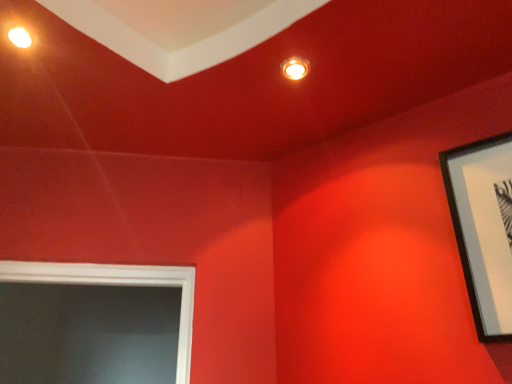
Question: Should I look upward or downward to see black matte picture frame at upper right?

Choices:
 (A) up
 (B) down

Answer: (B)

Question: Could you tell me if black matte picture frame at upper right is facing matte orange light fixture at upper center?

Choices:
 (A) yes
 (B) no

Answer: (B)

Question: Is matte orange light fixture at upper center at the back of black matte picture frame at upper right?

Choices:
 (A) no
 (B) yes

Answer: (A)

Question: Does black matte picture frame at upper right appear on the left side of matte orange light fixture at upper center?

Choices:
 (A) no
 (B) yes

Answer: (A)

Question: Could matte orange light fixture at upper center be considered to be inside black matte picture frame at upper right?

Choices:
 (A) no
 (B) yes

Answer: (A)

Question: Does black matte picture frame at upper right have a greater height compared to matte orange light fixture at upper center?

Choices:
 (A) no
 (B) yes

Answer: (B)

Question: From the image's perspective, would you say black matte picture frame at upper right is positioned over matte orange light fixture at upper center?

Choices:
 (A) no
 (B) yes

Answer: (A)

Question: Does matte orange light fixture at upper center come in front of black matte picture frame at upper right?

Choices:
 (A) yes
 (B) no

Answer: (B)

Question: From a real-world perspective, is matte orange light fixture at upper center on top of black matte picture frame at upper right?

Choices:
 (A) yes
 (B) no

Answer: (A)

Question: Is matte orange light fixture at upper center further to the viewer compared to black matte picture frame at upper right?

Choices:
 (A) no
 (B) yes

Answer: (B)

Question: Does matte orange light fixture at upper center have a greater height compared to black matte picture frame at upper right?

Choices:
 (A) no
 (B) yes

Answer: (A)

Question: Can you confirm if matte orange light fixture at upper center is thinner than black matte picture frame at upper right?

Choices:
 (A) yes
 (B) no

Answer: (B)

Question: Could black matte picture frame at upper right be considered to be inside matte orange light fixture at upper center?

Choices:
 (A) yes
 (B) no

Answer: (B)

Question: Looking at their shapes, would you say matte orange light fixture at upper center is wider or thinner than black matte picture frame at upper right?

Choices:
 (A) thin
 (B) wide

Answer: (B)